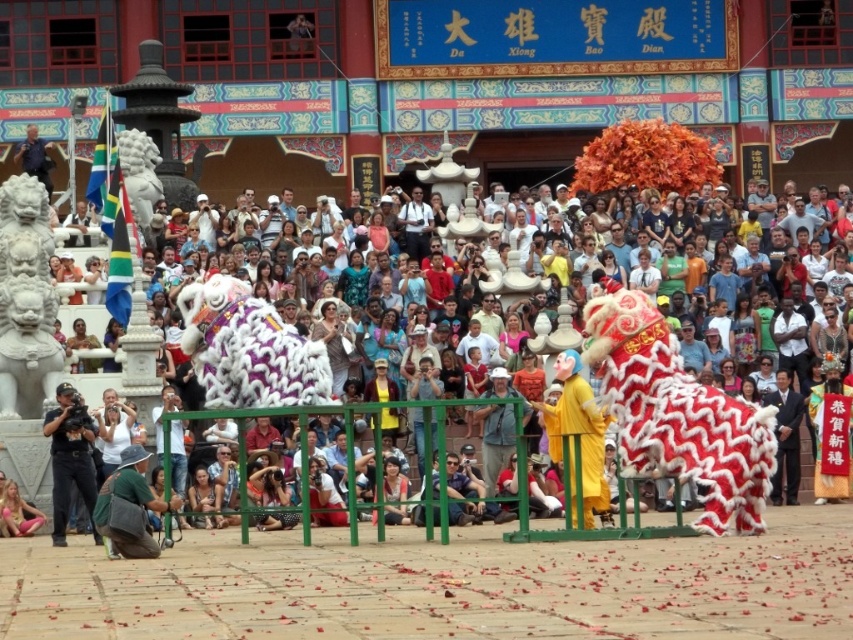
You are standing in front of the Great Buddha Hall and notice two points marked in the scene. Which point is closer to you, point (596, 477) or point (144, 497)?

Point (596, 477) is further to the viewer than point (144, 497), so point (144, 497) is closer to you.

You are a photographer at the event and want to capture a photo of the green fabric bag at lower left and the pink fabric at lower left. Which of the two fabrics is closer to the camera?

The green fabric bag at lower left is shorter than the pink fabric at lower left, so the green fabric bag at lower left is closer to the camera.

You are a photographer standing at the edge of the event. You notice a black matte camera at lower left and a pink fabric at lower left. Which object is shorter?

The black matte camera at lower left is not as tall as the pink fabric at lower left, so the black matte camera at lower left is shorter.